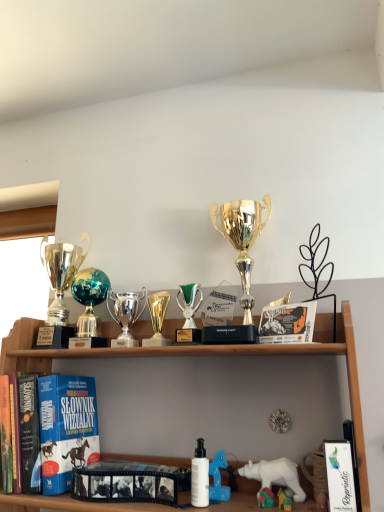
Question: Is white matte bottle at center outside green metallic trophy at center, positioned as the 4th toy in left-to-right order?

Choices:
 (A) no
 (B) yes

Answer: (B)

Question: Is white matte bottle at center oriented away from green metallic trophy at center, positioned as the 4th toy in left-to-right order?

Choices:
 (A) yes
 (B) no

Answer: (B)

Question: From a real-world perspective, is white matte bottle at center positioned under green metallic trophy at center, positioned as the 4th toy in left-to-right order, based on gravity?

Choices:
 (A) yes
 (B) no

Answer: (A)

Question: Is white matte bottle at center smaller than green metallic trophy at center, which is the second toy from right to left?

Choices:
 (A) yes
 (B) no

Answer: (A)

Question: Is the depth of white matte bottle at center greater than that of green metallic trophy at center, which is the second toy from right to left?

Choices:
 (A) no
 (B) yes

Answer: (A)

Question: Is white plastic bear at lower center wider or thinner than white glossy book at lower right, the third book when ordered from back to front?

Choices:
 (A) thin
 (B) wide

Answer: (A)

Question: From the image's perspective, is white plastic bear at lower center above or below white glossy book at lower right, arranged as the 1th book when viewed from the right?

Choices:
 (A) above
 (B) below

Answer: (B)

Question: Considering the positions of white plastic bear at lower center and white glossy book at lower right, which is the third book in left-to-right order, in the image, is white plastic bear at lower center taller or shorter than white glossy book at lower right, which is the third book in left-to-right order,?

Choices:
 (A) tall
 (B) short

Answer: (B)

Question: Based on their sizes in the image, would you say white plastic bear at lower center is bigger or smaller than white glossy book at lower right, which is the third book in left-to-right order?

Choices:
 (A) big
 (B) small

Answer: (B)

Question: From a real-world perspective, is shiny silver trophy at center, which is the 2th toy in left-to-right order, positioned above or below black matte film strip at center, which appears as the second book when viewed from the front?

Choices:
 (A) below
 (B) above

Answer: (B)

Question: Considering the positions of shiny silver trophy at center, which is the 2th toy in left-to-right order, and black matte film strip at center, which appears as the second book when viewed from the front, in the image, is shiny silver trophy at center, which is the 2th toy in left-to-right order, bigger or smaller than black matte film strip at center, which appears as the second book when viewed from the front,?

Choices:
 (A) big
 (B) small

Answer: (B)

Question: Is shiny silver trophy at center, which is the 2th toy in left-to-right order, taller or shorter than black matte film strip at center, which is the second book from left to right?

Choices:
 (A) tall
 (B) short

Answer: (A)

Question: Is shiny silver trophy at center, marked as the 4th toy in a right-to-left arrangement, in front of or behind black matte film strip at center, which is the 2th book from back to front, in the image?

Choices:
 (A) front
 (B) behind

Answer: (B)

Question: Is point (304, 470) closer or farther from the camera than point (109, 310)?

Choices:
 (A) farther
 (B) closer

Answer: (B)

Question: Considering the positions of white plastic bear at lower right, placed as the 1th toy when sorted from right to left, and shiny silver trophy at center, which is the 2th toy in left-to-right order, in the image, is white plastic bear at lower right, placed as the 1th toy when sorted from right to left, wider or thinner than shiny silver trophy at center, which is the 2th toy in left-to-right order,?

Choices:
 (A) thin
 (B) wide

Answer: (B)